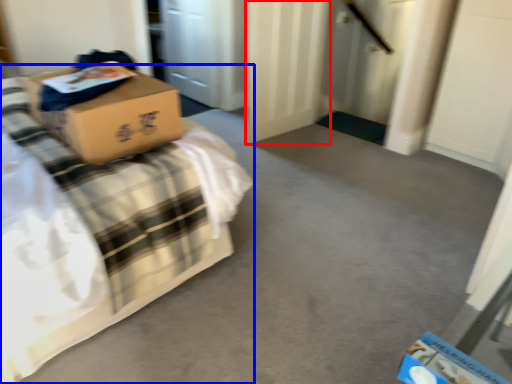
Question: Among these objects, which one is nearest to the camera, door (highlighted by a red box) or bed (highlighted by a blue box)?

Choices:
 (A) door
 (B) bed

Answer: (B)